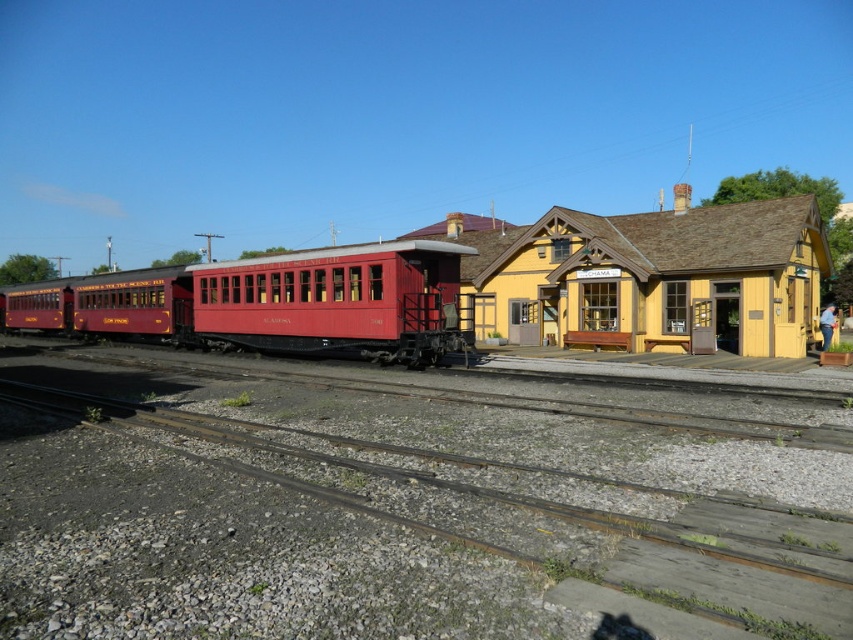
You are standing at the railway station in Alamosa and want to locate two specific points marked on the scene. Which of the two points, point 1 at coordinates point (10, 547) or point 2 at coordinates point (51, 314), is closer to you?

Point 1 at coordinates point (10, 547) is closer to you than point 2 at coordinates point (51, 314).

You are standing at the gravel at center represented by point (395, 515). You want to walk to the vintage red passenger train car on the left. Which direction should you go?

You should walk to the left because the vintage red passenger train car on the left is located to the left of the gravel at center represented by point (395, 515).

You are a traveler standing at the gravel at center. You want to board the matte red train car at center. Which direction should you move to reach it?

The gravel at center is below the matte red train car at center, so you should move upward to reach the matte red train car at center.